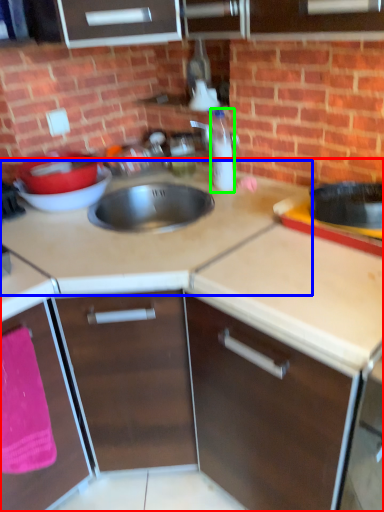
Question: Which is farther away from countertop (highlighted by a red box)? countertop (highlighted by a blue box) or bottle (highlighted by a green box)?

Choices:
 (A) countertop
 (B) bottle

Answer: (B)